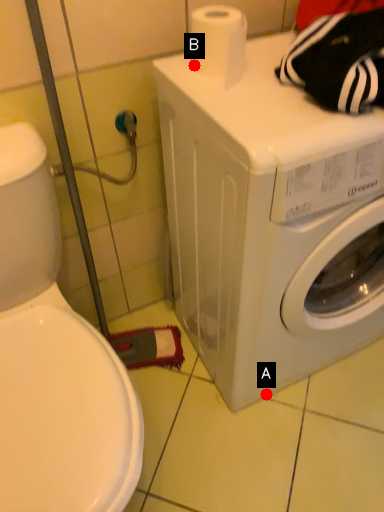
Question: Two points are circled on the image, labeled by A and B beside each circle. Which point appears farthest from the camera in this image?

Choices:
 (A) A is further
 (B) B is further

Answer: (A)